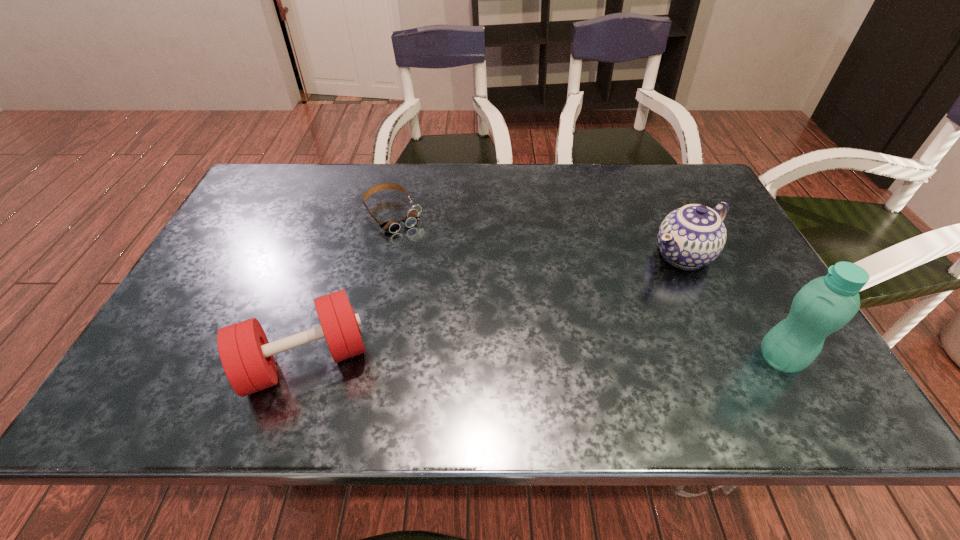
At what (x,y) coordinates should I click in order to perform the action: click on dumbbell. Please return your answer as a coordinate pair (x, y). The height and width of the screenshot is (540, 960). Looking at the image, I should click on (246, 355).

The image size is (960, 540). I want to click on bottle, so click(x=826, y=304).

Locate an element on the screen. The width and height of the screenshot is (960, 540). the shortest object is located at coordinates (392, 226).

The width and height of the screenshot is (960, 540). What are the coordinates of `chinaware` in the screenshot? It's located at (692, 236).

Where is `vacant space located on the right of the dumbbell`? This screenshot has width=960, height=540. vacant space located on the right of the dumbbell is located at coordinates (543, 360).

You are a GUI agent. You are given a task and a screenshot of the screen. Output one action in this format:
    pyautogui.click(x=<x>, y=<y>)
    Task: Click on the vacant space located 0.200m on the back of the bottle
    
    Given the screenshot: What is the action you would take?
    pyautogui.click(x=733, y=275)

At what (x,y) coordinates should I click in order to perform the action: click on vacant space located on the front-facing side of the shortest object. Please return your answer as a coordinate pair (x, y). This screenshot has width=960, height=540. Looking at the image, I should click on (424, 259).

At what (x,y) coordinates should I click in order to perform the action: click on free spot located 0.320m on the front-facing side of the shortest object. Please return your answer as a coordinate pair (x, y). Image resolution: width=960 pixels, height=540 pixels. Looking at the image, I should click on (461, 309).

Locate an element on the screen. The image size is (960, 540). vacant position located on the front-facing side of the shortest object is located at coordinates (426, 261).

You are a GUI agent. You are given a task and a screenshot of the screen. Output one action in this format:
    pyautogui.click(x=<x>, y=<y>)
    Task: Click on the free spot located 0.390m at the spout of the chinaware
    
    Given the screenshot: What is the action you would take?
    pyautogui.click(x=536, y=335)